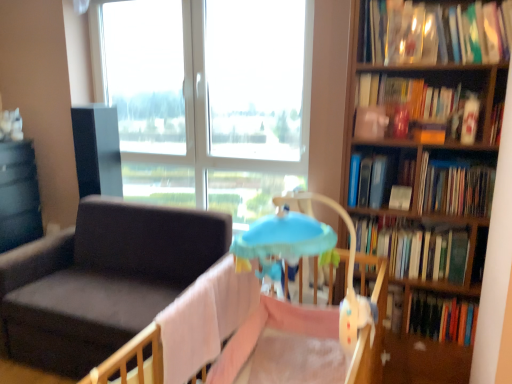
Question: Considering the relative sizes of matte black table at left and hardcover book at right, positioned as the 2th book in bottom-to-top order, in the image provided, is matte black table at left wider than hardcover book at right, positioned as the 2th book in bottom-to-top order,?

Choices:
 (A) yes
 (B) no

Answer: (A)

Question: Is matte black table at left bigger than hardcover book at right, positioned as the 2th book in bottom-to-top order?

Choices:
 (A) no
 (B) yes

Answer: (B)

Question: From the image's perspective, would you say matte black table at left is shown under hardcover book at right, which ranks as the 4th book in top-to-bottom order?

Choices:
 (A) yes
 (B) no

Answer: (A)

Question: Is the depth of matte black table at left greater than that of hardcover book at right, which ranks as the 4th book in top-to-bottom order?

Choices:
 (A) no
 (B) yes

Answer: (B)

Question: Considering the relative positions of matte black table at left and hardcover book at right, which ranks as the 4th book in top-to-bottom order, in the image provided, is matte black table at left to the left of hardcover book at right, which ranks as the 4th book in top-to-bottom order, from the viewer's perspective?

Choices:
 (A) no
 (B) yes

Answer: (B)

Question: In terms of width, does transparent glass window at upper center look wider or thinner when compared to hardcover book at right, which ranks as the 1th book in bottom-to-top order?

Choices:
 (A) thin
 (B) wide

Answer: (A)

Question: In terms of size, does transparent glass window at upper center appear bigger or smaller than hardcover book at right, the fifth book in the top-to-bottom sequence?

Choices:
 (A) small
 (B) big

Answer: (B)

Question: Is transparent glass window at upper center taller or shorter than hardcover book at right, the fifth book in the top-to-bottom sequence?

Choices:
 (A) tall
 (B) short

Answer: (A)

Question: Does point (250, 29) appear closer or farther from the camera than point (423, 271)?

Choices:
 (A) closer
 (B) farther

Answer: (B)

Question: Looking at the image, does hardcover book at upper right, the second book from the top, seem bigger or smaller compared to wooden bookshelf at right?

Choices:
 (A) big
 (B) small

Answer: (B)

Question: Is hardcover book at upper right, the second book from the top, wider or thinner than wooden bookshelf at right?

Choices:
 (A) wide
 (B) thin

Answer: (B)

Question: Is hardcover book at upper right, marked as the 4th book in a bottom-to-top arrangement, taller or shorter than wooden bookshelf at right?

Choices:
 (A) short
 (B) tall

Answer: (A)

Question: Considering the positions of point (497, 135) and point (407, 142), is point (497, 135) closer or farther from the camera than point (407, 142)?

Choices:
 (A) farther
 (B) closer

Answer: (B)

Question: Is point (382, 273) positioned closer to the camera than point (4, 205)?

Choices:
 (A) closer
 (B) farther

Answer: (A)

Question: Is pink fabric infant bed at center taller or shorter than matte black table at left?

Choices:
 (A) tall
 (B) short

Answer: (B)